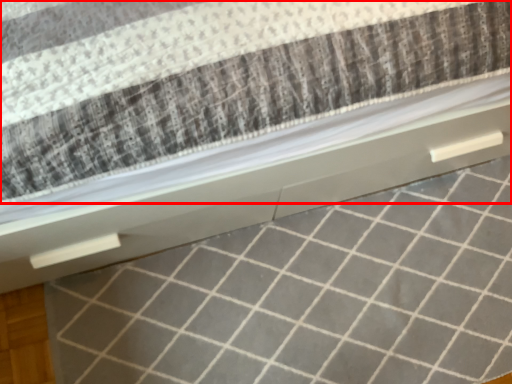
Question: From the image's perspective, what is the correct spatial relationship of mattress (annotated by the red box) in relation to tile?

Choices:
 (A) below
 (B) above

Answer: (B)